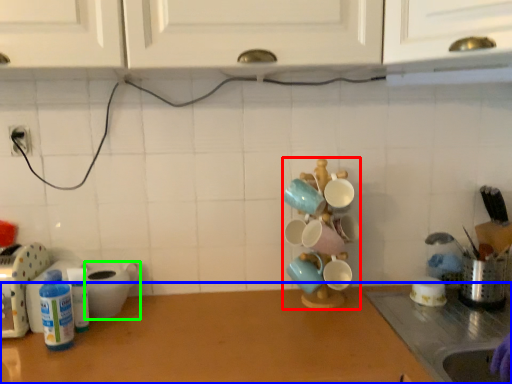
Question: Estimate the real-world distances between objects in this image. Which object is farther from tableware (highlighted by a red box), countertop (highlighted by a blue box) or appliance (highlighted by a green box)?

Choices:
 (A) countertop
 (B) appliance

Answer: (B)